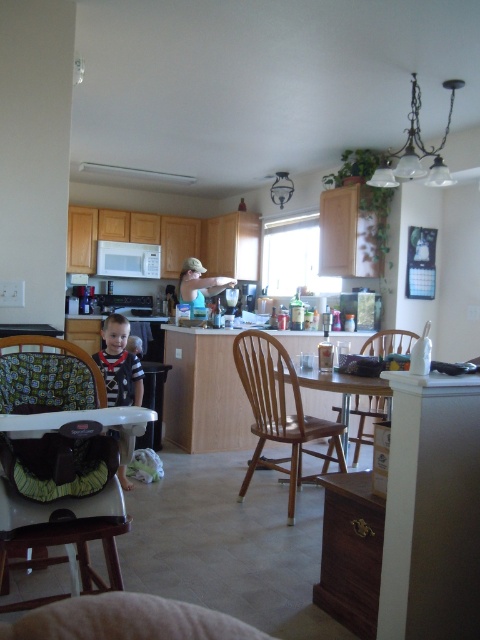
You are a parent trying to reach the wooden table at center from the green fabric highchair at lower left. Which direction should you move to get there?

The green fabric highchair at lower left is closer to the viewer than the wooden table at center, so you should move forward towards the wooden table at center to reach it.

You are a parent trying to rearrange the kitchen for a family gathering. You need to move the green fabric highchair at lower left and the wooden chair at center to the dining area. Which object will require more space when moving?

The wooden chair at center requires more space because the green fabric highchair at lower left occupies less space than the wooden chair at center.